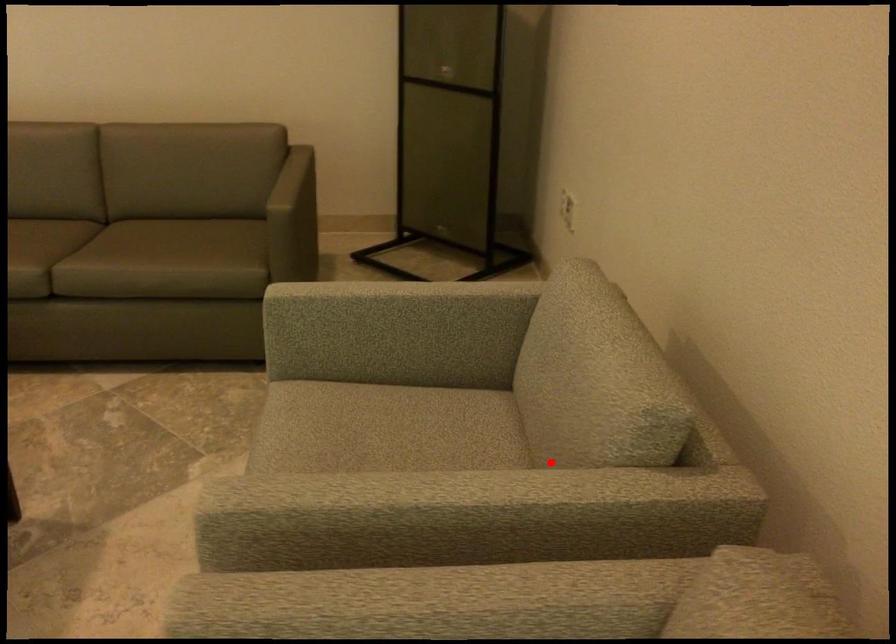
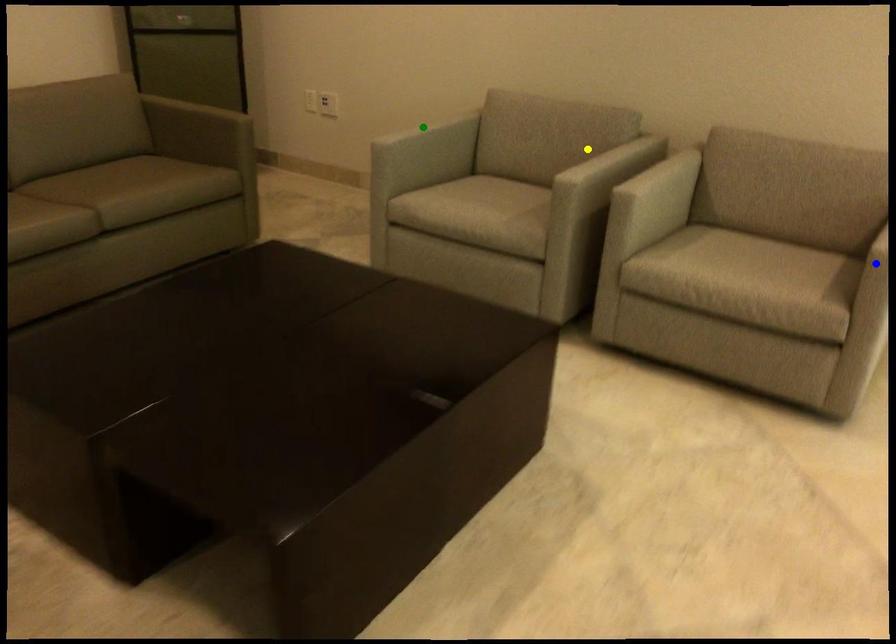
Question: I am providing you with two images of the same scene from different viewpoints. A red point is marked on the first image. You are given multiple points on the second image. Which spot in image 2 lines up with the point in image 1?

Choices:
 (A) yellow point
 (B) green point
 (C) blue point

Answer: (A)